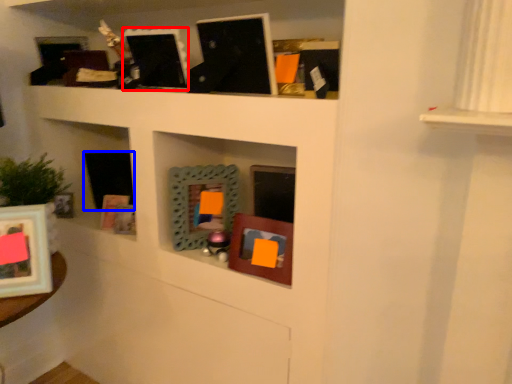
Question: Which object is closer to the camera taking this photo, picture frame (highlighted by a red box) or picture frame (highlighted by a blue box)?

Choices:
 (A) picture frame
 (B) picture frame

Answer: (A)